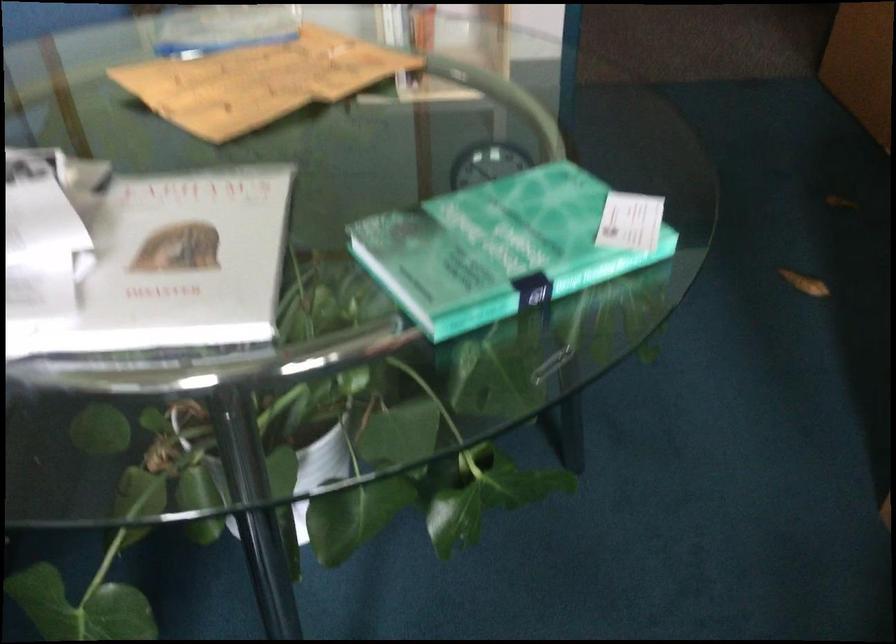
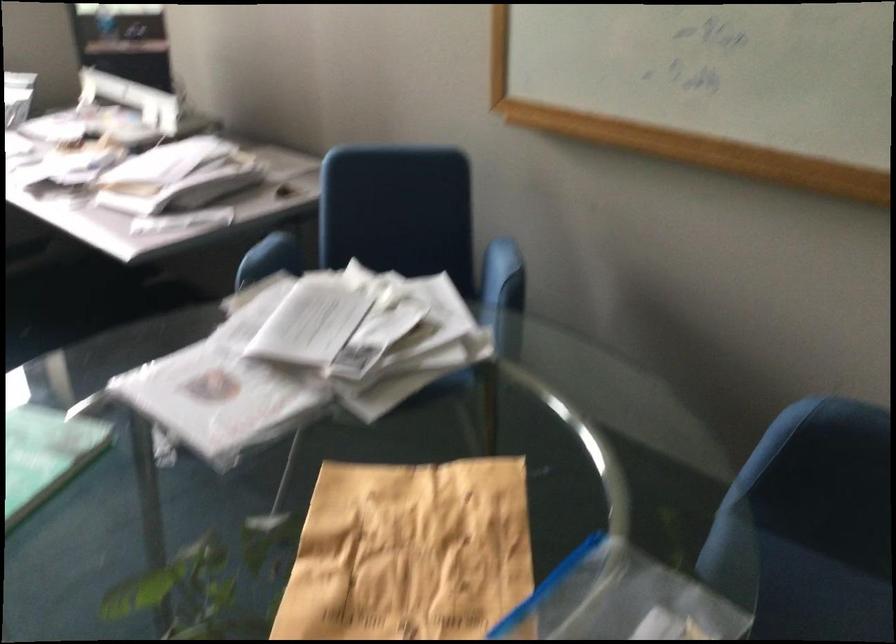
The point at (220,86) is marked in the first image. Where is the corresponding point in the second image?

(409, 552)